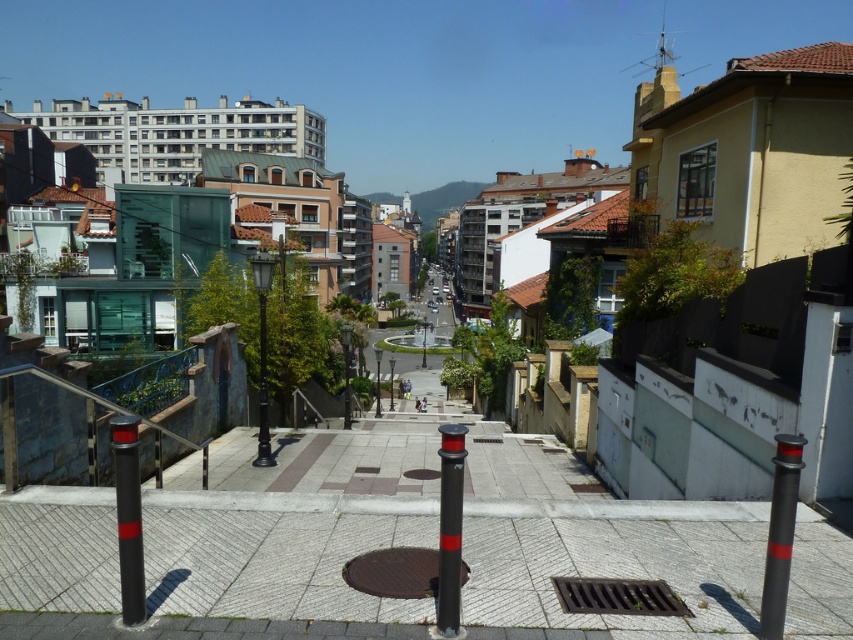
You are a delivery person needing to place a heavy box on the ground. Which object, the smooth concrete pavement at center or the black metal pole at center, is a suitable surface for placing the box?

The smooth concrete pavement at center is a suitable surface for placing the box because it is above the black metal pole at center and provides a stable, flat area.

You are standing at the entrance of the building and want to walk to the smooth concrete pavement at center. According to the scene description, in which direction should you head relative to the staircase on your left?

The smooth concrete pavement at center is located ahead of the staircase on the left, so you should head straight forward from the entrance towards the center of the scene.

You are a city planner reviewing the layout of this urban area. You need to ensure that all poles are visible to pedestrians and vehicles. Given the positions of the black rubber pole at lower left and the black polished pole at center, which pole might be obstructing the view of the other?

The black rubber pole at lower left is positioned under the black polished pole at center, so it might be obstructed by the black polished pole at center.